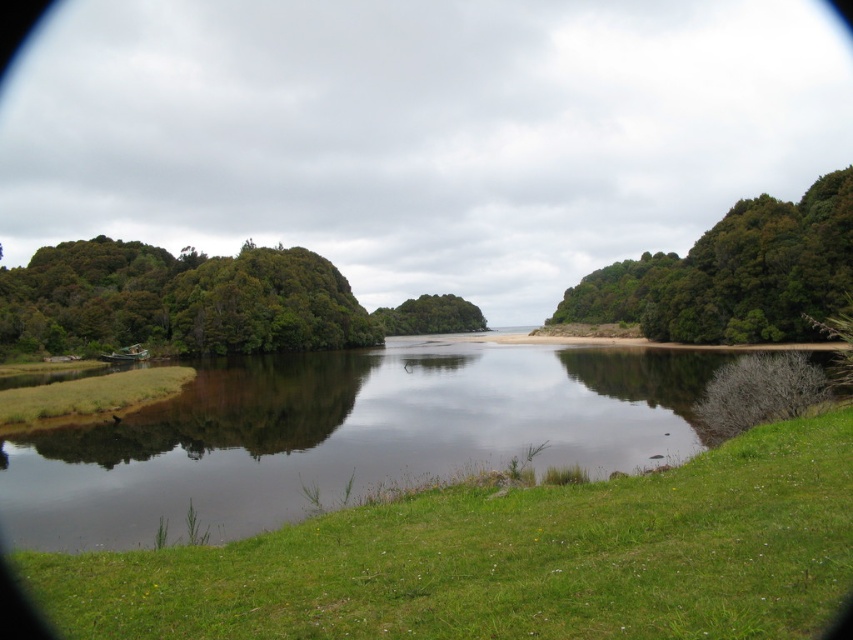
Question: Can you confirm if green grassy river at center is positioned above green leafy tree at center?

Choices:
 (A) no
 (B) yes

Answer: (A)

Question: Estimate the real-world distances between objects in this image. Which object is farther from the green leafy trees at left?

Choices:
 (A) green leafy tree at center
 (B) green grassy river at center

Answer: (B)

Question: Observing the image, what is the correct spatial positioning of green leafy tree at upper right in reference to green leafy tree at center?

Choices:
 (A) above
 (B) below

Answer: (A)

Question: Which point is farther to the camera?

Choices:
 (A) click(x=805, y=321)
 (B) click(x=0, y=339)

Answer: (B)

Question: Which object is closer to the camera taking this photo?

Choices:
 (A) green leafy trees at left
 (B) green grassy river at center
 (C) green leafy tree at upper right
 (D) green leafy tree at center

Answer: (B)

Question: Can you confirm if green grassy river at center is positioned to the left of green leafy tree at upper right?

Choices:
 (A) yes
 (B) no

Answer: (A)